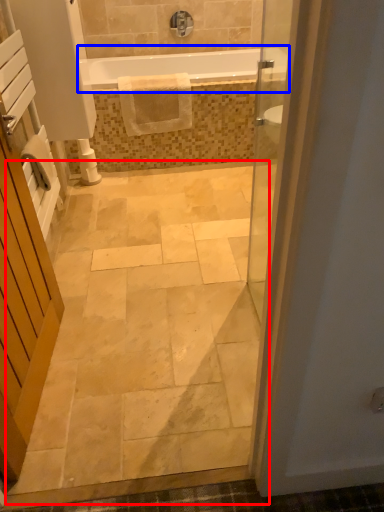
Question: Which of the following is the closest to the observer, path (highlighted by a red box) or bathtub (highlighted by a blue box)?

Choices:
 (A) path
 (B) bathtub

Answer: (A)